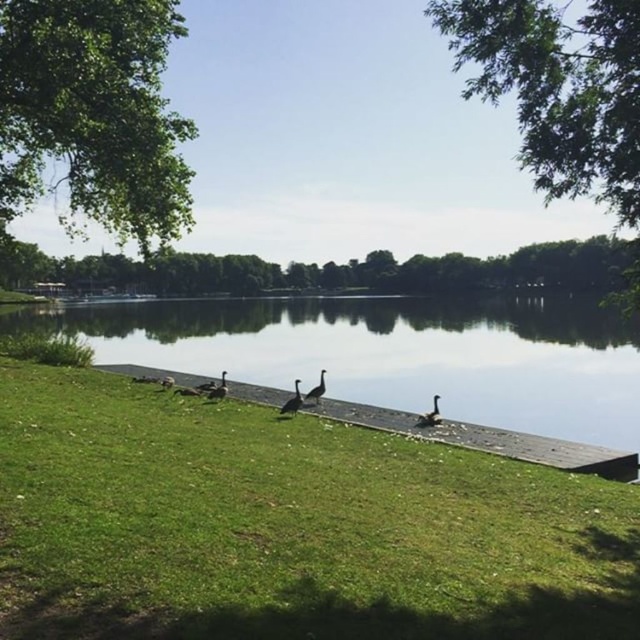
You are standing at the edge of the lake and see the green grass at center and the transparent glass water at lower center. Which object is closer to your right side?

The green grass at center is to the right of transparent glass water at lower center, so the green grass at center is closer to your right side.

You are a photographer planning to capture the entire scene in one shot. Given that the green grass at center and the transparent glass water at lower center are both in your frame, which object will appear smaller in the photo?

The green grass at center will appear smaller in the photo because it has a smaller size compared to the transparent glass water at lower center.